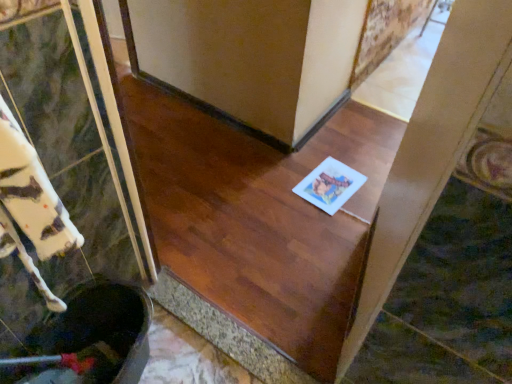
Image resolution: width=512 pixels, height=384 pixels. Find the location of `white paper at center`. white paper at center is located at coordinates (330, 185).

What is the approximate width of white paper at center?

It is 11.57 inches.

Image resolution: width=512 pixels, height=384 pixels. Describe the element at coordinates (330, 185) in the screenshot. I see `white paper at center` at that location.

Find the location of `white paper at center`. white paper at center is located at coordinates (256, 231).

Describe the element at coordinates (256, 231) in the screenshot. I see `white paper at center` at that location.

Identify the location of white paper at center. The image size is (512, 384). (330, 185).

Which is more to the left, white paper at center or white paper at center?

From the viewer's perspective, white paper at center appears more on the left side.

Looking at this image, which is behind, white paper at center or white paper at center?

white paper at center.

Which is closer to the camera, (333, 165) or (208, 154)?

Point (333, 165) appears to be closer to the viewer than point (208, 154).

From the image's perspective, which object appears higher, white paper at center or white paper at center?

white paper at center is shown above in the image.

From a real-world perspective, which is physically above, white paper at center or white paper at center?

white paper at center is physically above.

Considering the relative sizes of white paper at center and white paper at center in the image provided, is white paper at center wider than white paper at center?

Indeed, white paper at center has a greater width compared to white paper at center.

In terms of height, does white paper at center look taller or shorter compared to white paper at center?

Considering their sizes, white paper at center has less height than white paper at center.

Considering the relative sizes of white paper at center and white paper at center in the image provided, is white paper at center bigger than white paper at center?

Incorrect, white paper at center is not larger than white paper at center.

Would you say white paper at center is outside white paper at center?

Yes, white paper at center is not within white paper at center.

Are white paper at center and white paper at center far apart?

Actually, white paper at center and white paper at center are a little close together.

Is white paper at center facing away from white paper at center?

That's not correct — white paper at center is not looking away from white paper at center.

How different are the orientations of white paper at center and white paper at center in degrees?

The facing directions of white paper at center and white paper at center are 6.82 degrees apart.

The image size is (512, 384). I want to click on copy behind the white paper at center, so click(x=330, y=185).

Which is more to the right, white paper at center or white paper at center?

white paper at center.

Considering the positions of objects white paper at center and white paper at center in the image provided, who is in front, white paper at center or white paper at center?

white paper at center is in front.

Does point (140, 104) appear closer or farther from the camera than point (331, 207)?

Clearly, point (140, 104) is more distant from the camera than point (331, 207).

From the image's perspective, between white paper at center and white paper at center, which one is located above?

white paper at center is shown above in the image.

From a real-world perspective, is white paper at center positioned above or below white paper at center?

Clearly, from a real-world perspective, white paper at center is above white paper at center.

Considering the sizes of objects white paper at center and white paper at center in the image provided, who is thinner, white paper at center or white paper at center?

Thinner between the two is white paper at center.

Can you confirm if white paper at center is taller than white paper at center?

Correct, white paper at center is much taller as white paper at center.

Can you confirm if white paper at center is smaller than white paper at center?

No, white paper at center is not smaller than white paper at center.

Is white paper at center located within white paper at center?

No, white paper at center is not a part of white paper at center.

Can you see white paper at center touching white paper at center?

No, white paper at center is not touching white paper at center.

Is white paper at center looking in the opposite direction of white paper at center?

Yes, white paper at center is at the back of white paper at center.

You are a GUI agent. You are given a task and a screenshot of the screen. Output one action in this format:
    pyautogui.click(x=<x>, y=<y>)
    Task: Click on the stairwell below the white paper at center (from the image's perspective)
    The image size is (512, 384).
    Given the screenshot: What is the action you would take?
    256,231

Locate an element on the screen. The image size is (512, 384). copy lying behind the white paper at center is located at coordinates (330, 185).

Locate an element on the screen. Image resolution: width=512 pixels, height=384 pixels. stairwell below the white paper at center (from the image's perspective) is located at coordinates (256, 231).